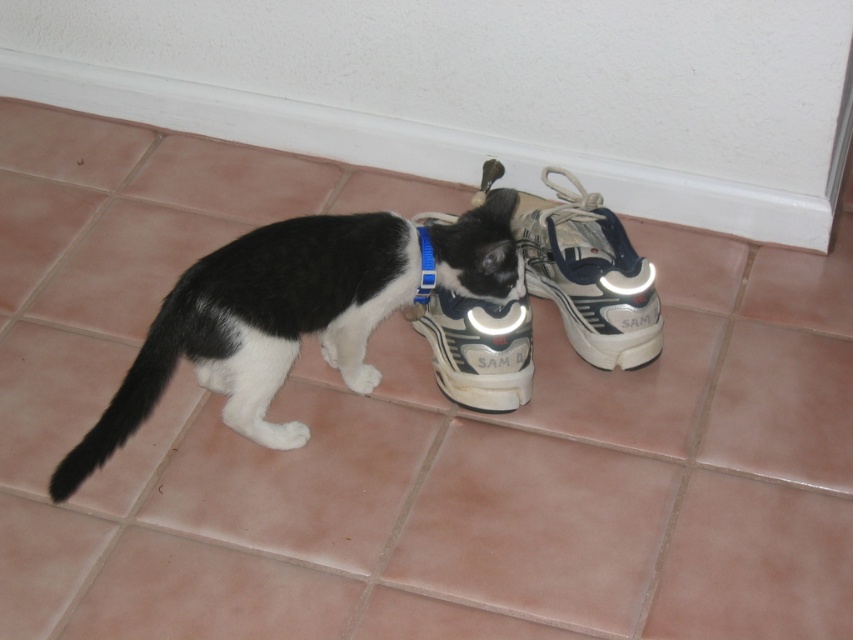
Who is positioned more to the right, white synthetic shoe at center or white matte shoe at center?

white synthetic shoe at center is more to the right.

Does white synthetic shoe at center have a greater width compared to white matte shoe at center?

Yes, white synthetic shoe at center is wider than white matte shoe at center.

Does point (567, 260) come in front of point (437, 298)?

Yes, it is in front of point (437, 298).

You are a GUI agent. You are given a task and a screenshot of the screen. Output one action in this format:
    pyautogui.click(x=<x>, y=<y>)
    Task: Click on the white synthetic shoe at center
    The image size is (853, 640).
    Given the screenshot: What is the action you would take?
    [x=590, y=275]

Who is more distant from viewer, [334,305] or [596,234]?

The point [596,234] is more distant.

The image size is (853, 640). I want to click on black matte/synthetic cat at center, so click(262, 324).

Does point (445, 356) lie in front of point (422, 269)?

No.

Can you confirm if white matte shoe at center is positioned to the left of blue fabric neckband at center?

In fact, white matte shoe at center is to the right of blue fabric neckband at center.

Image resolution: width=853 pixels, height=640 pixels. What do you see at coordinates (477, 348) in the screenshot? I see `white matte shoe at center` at bounding box center [477, 348].

Find the location of `white matte shoe at center`. white matte shoe at center is located at coordinates click(477, 348).